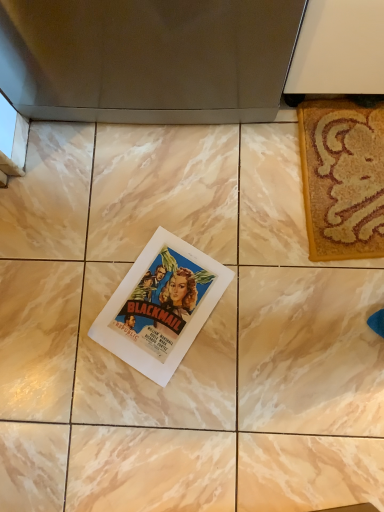
Locate an element on the screen. The image size is (384, 512). free spot below white paper at center (from a real-world perspective) is located at coordinates (167, 302).